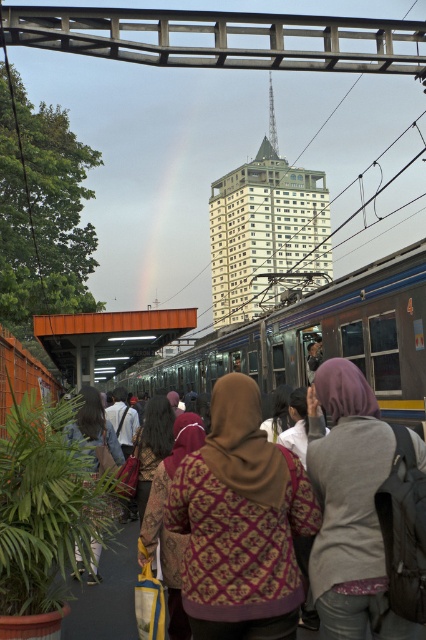
Can you confirm if patterned fabric headscarf at center is smaller than metallic silver train at center?

Yes, patterned fabric headscarf at center is smaller than metallic silver train at center.

Is patterned fabric headscarf at center bigger than metallic silver train at center?

Actually, patterned fabric headscarf at center might be smaller than metallic silver train at center.

Where is `patterned fabric headscarf at center`? patterned fabric headscarf at center is located at coordinates (241, 522).

Find the location of a particular element. The image size is (426, 640). patterned fabric headscarf at center is located at coordinates (241, 522).

Can you confirm if metallic silver train at center is positioned to the left of gray fleece jacket at center?

Correct, you'll find metallic silver train at center to the left of gray fleece jacket at center.

Measure the distance between metallic silver train at center and camera.

metallic silver train at center and camera are 7.01 meters apart.

Which is behind, point (388, 355) or point (357, 612)?

The point (388, 355) is behind.

The height and width of the screenshot is (640, 426). In order to click on metallic silver train at center in this screenshot , I will do `click(321, 339)`.

Where is `patterned fabric headscarf at center`? The image size is (426, 640). patterned fabric headscarf at center is located at coordinates (241, 522).

Locate an element on the screen. The image size is (426, 640). patterned fabric headscarf at center is located at coordinates (241, 522).